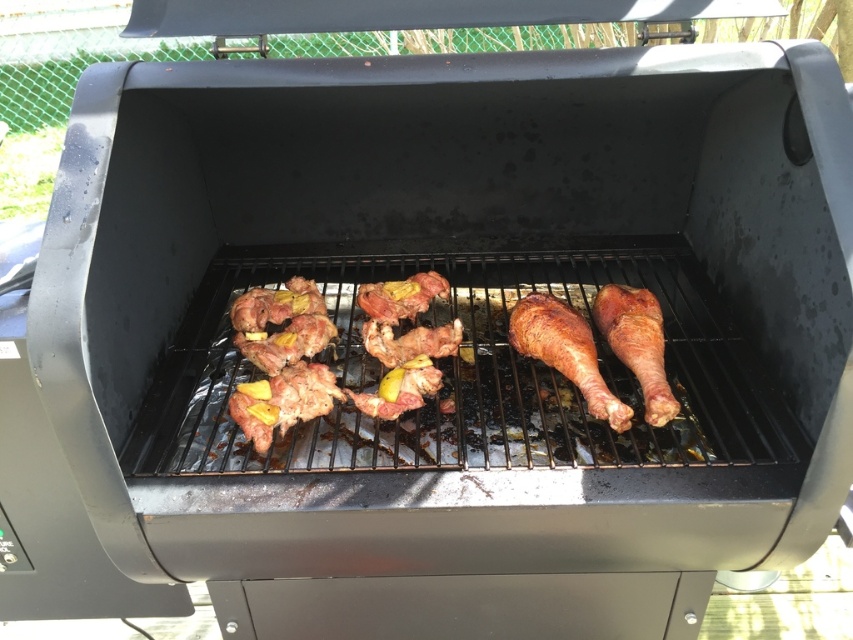
Question: Is golden brown crispy drumstick at center closer to camera compared to pinkish raw meat at center?

Choices:
 (A) yes
 (B) no

Answer: (B)

Question: Which object appears closest to the camera in this image?

Choices:
 (A) pinkish-brown meat at center
 (B) pinkish raw meat at center
 (C) brown matte chicken leg at center
 (D) smoked brown chicken leg at center

Answer: (B)

Question: Is smoked brown chicken leg at center above brown matte chicken leg at center?

Choices:
 (A) yes
 (B) no

Answer: (A)

Question: Does pinkish raw meat at center come in front of pinkish-brown meat at center?

Choices:
 (A) yes
 (B) no

Answer: (A)

Question: Which object is closer to the camera taking this photo?

Choices:
 (A) golden brown crispy drumstick at center
 (B) pinkish raw meat at center
 (C) pinkish-brown meat at center
 (D) smoked brown chicken leg at center

Answer: (B)

Question: Which object is farther from the camera taking this photo?

Choices:
 (A) pinkish-brown meat at center
 (B) pinkish raw meat at center
 (C) golden brown crispy drumstick at center

Answer: (A)